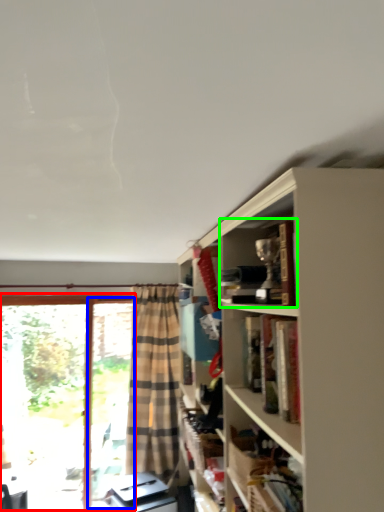
Question: Which is farther away from bay window (highlighted by a red box)? screen door (highlighted by a blue box) or book (highlighted by a green box)?

Choices:
 (A) screen door
 (B) book

Answer: (B)